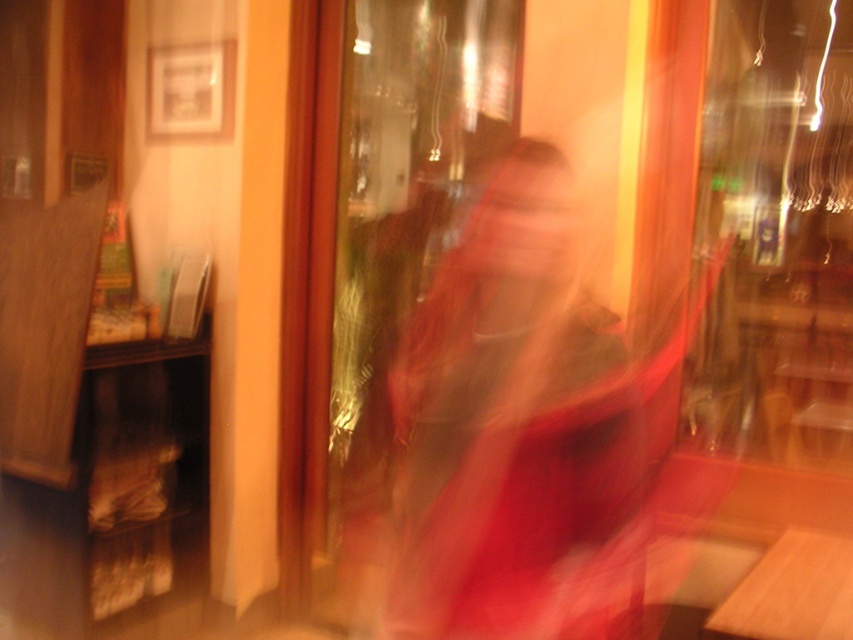
Question: Among these objects, which one is farthest from the camera?

Choices:
 (A) transparent glass shop window at upper right
 (B) silky red dress at center
 (C) transparent glass door at center

Answer: (C)

Question: Can you confirm if transparent glass shop window at upper right is thinner than transparent glass door at center?

Choices:
 (A) yes
 (B) no

Answer: (A)

Question: Is silky red dress at center positioned at the back of transparent glass shop window at upper right?

Choices:
 (A) yes
 (B) no

Answer: (B)

Question: Where is transparent glass shop window at upper right located in relation to transparent glass door at center in the image?

Choices:
 (A) right
 (B) left

Answer: (A)

Question: Which of these objects is positioned farthest from the transparent glass door at center?

Choices:
 (A) transparent glass shop window at upper right
 (B) silky red dress at center

Answer: (B)

Question: Which point is farther to the camera?

Choices:
 (A) silky red dress at center
 (B) transparent glass door at center
 (C) transparent glass shop window at upper right

Answer: (B)